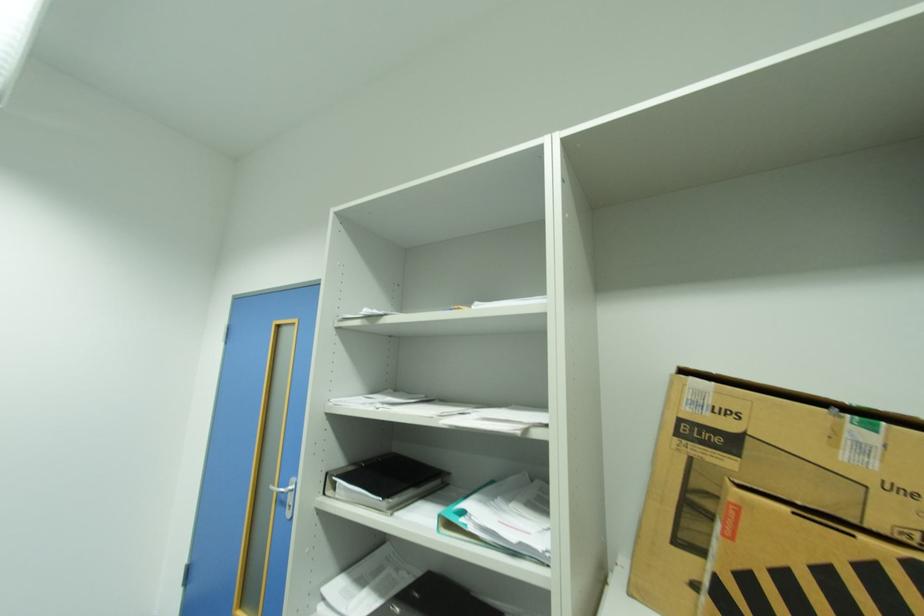
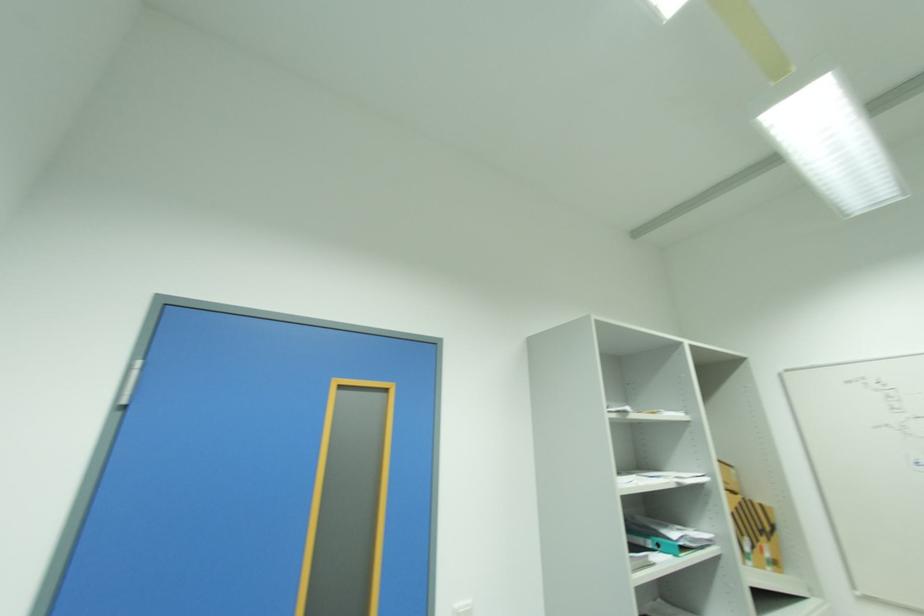
The point at (876, 573) is marked in the first image. Where is the corresponding point in the second image?

(746, 506)